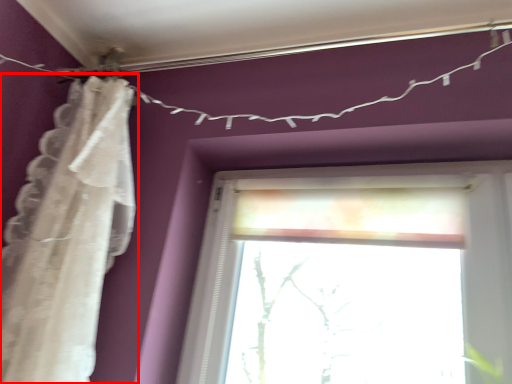
Question: Where is curtain (annotated by the red box) located in relation to clothesline in the image?

Choices:
 (A) left
 (B) right

Answer: (A)